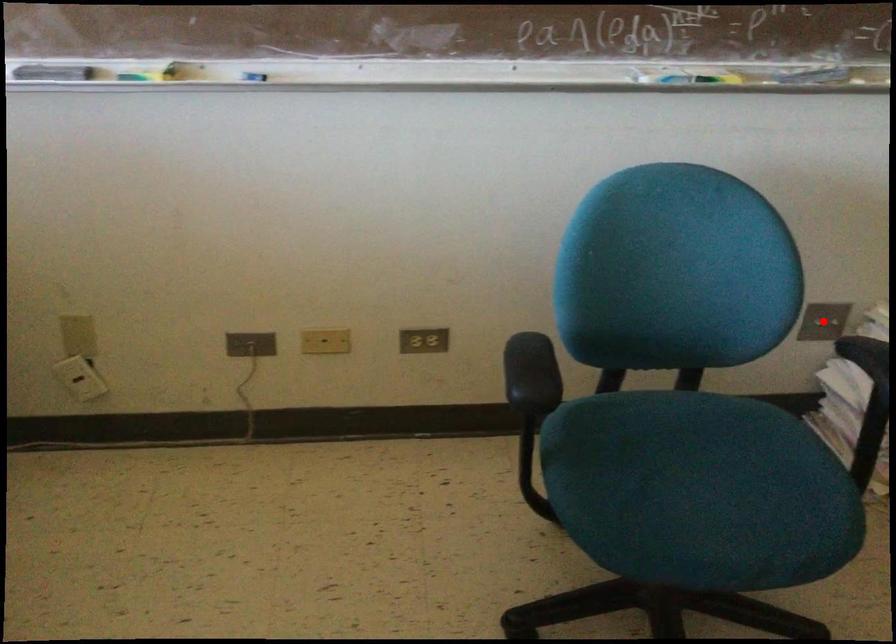
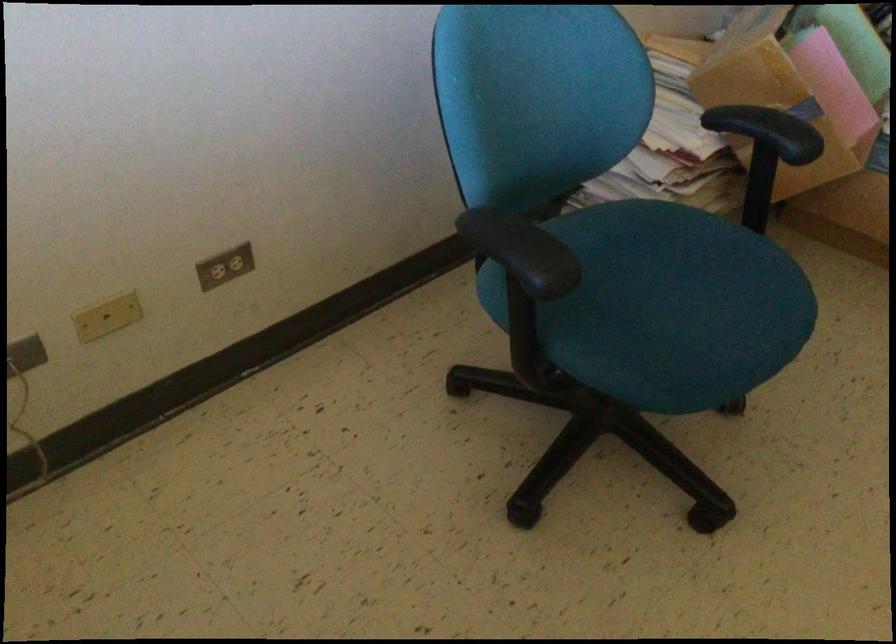
Question: I am providing you with two images of the same scene from different viewpoints. A red point is marked on the first image. Can you still see the location of the red point in image 2?

Choices:
 (A) Yes
 (B) No

Answer: (B)